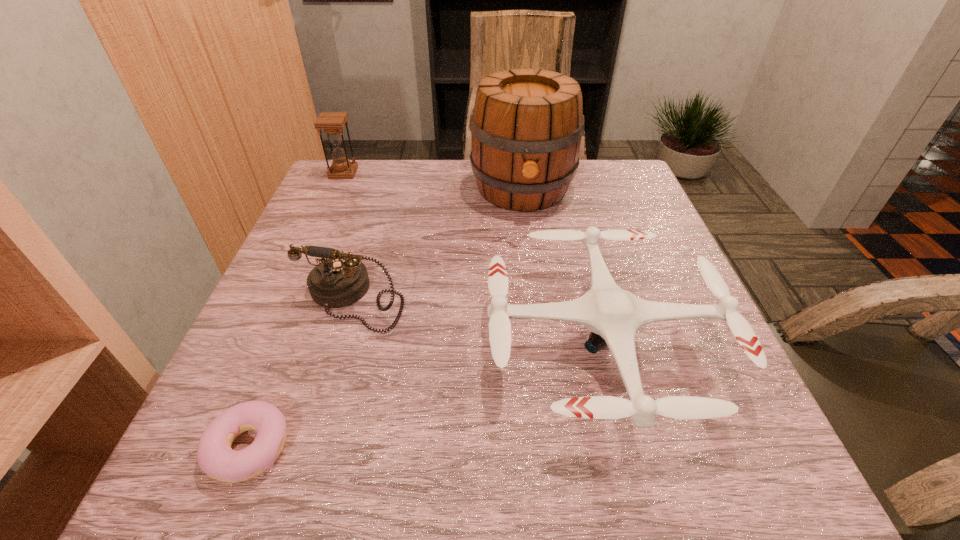
In order to click on hourglass at the far edge in this screenshot , I will do `click(332, 122)`.

The image size is (960, 540). I want to click on drone located at the near edge, so click(614, 315).

Locate an element on the screen. doughnut situated at the near edge is located at coordinates pyautogui.click(x=215, y=457).

Image resolution: width=960 pixels, height=540 pixels. I want to click on hourglass at the left edge, so click(332, 122).

Locate an element on the screen. This screenshot has height=540, width=960. telephone at the left edge is located at coordinates (340, 279).

This screenshot has width=960, height=540. I want to click on doughnut that is at the left edge, so click(x=215, y=457).

Identify the location of object that is at the right edge. (614, 315).

Find the location of a particular element. The height and width of the screenshot is (540, 960). object that is positioned at the far left corner is located at coordinates (332, 122).

Locate an element on the screen. object situated at the near left corner is located at coordinates (215, 457).

Find the location of a particular element. Image resolution: width=960 pixels, height=540 pixels. object that is at the near right corner is located at coordinates (614, 315).